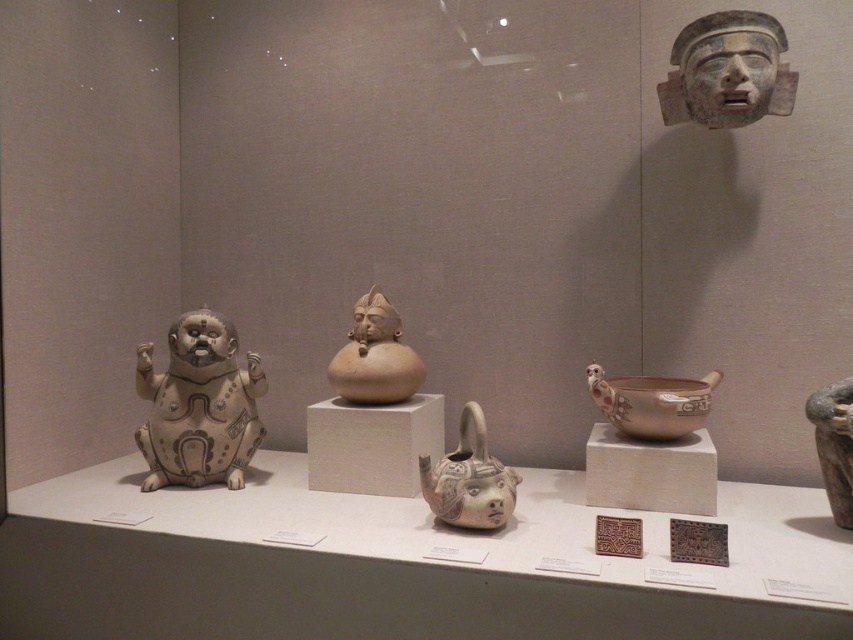
You are an archaeologist examining the display case. You need to document the position of the white matte figurine at left. What are its coordinates?

The white matte figurine at left is located at coordinates (199, 404).

You are a museum visitor who wants to take a photo of both the gray stone mask at upper right and the matte clay figure at center. Since the display case is glass, you need to position yourself so that your reflection doesn not appear in the photo. Which object should you stand closer to to achieve this?

You should stand closer to the matte clay figure at center because the gray stone mask at upper right is located above it. By positioning yourself closer to the lower object, your reflection is less likely to interfere with the shot.

You are a museum curator who needs to rearrange the display case. The new design requires placing a decorative plate between the white matte figurine at left and the matte clay teapot at center. The plate has a diameter of 12 inches. Will there be enough space between the two objects to fit the plate without moving them?

The distance between the white matte figurine at left and the matte clay teapot at center is 26.90 inches. Since the plate has a diameter of 12 inches, there is sufficient space as 26.90 inches is greater than 12 inches. Therefore, the plate can be placed between them without moving the original objects.